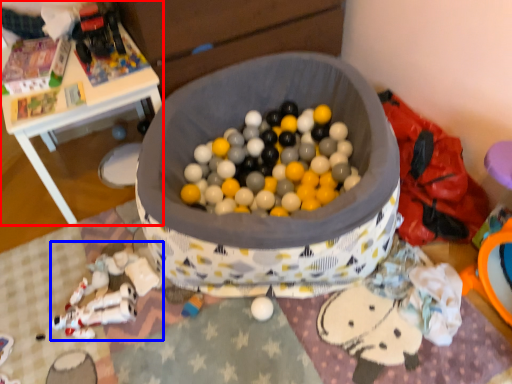
Question: Which object is further to the camera taking this photo, table (highlighted by a red box) or toy (highlighted by a blue box)?

Choices:
 (A) table
 (B) toy

Answer: (A)